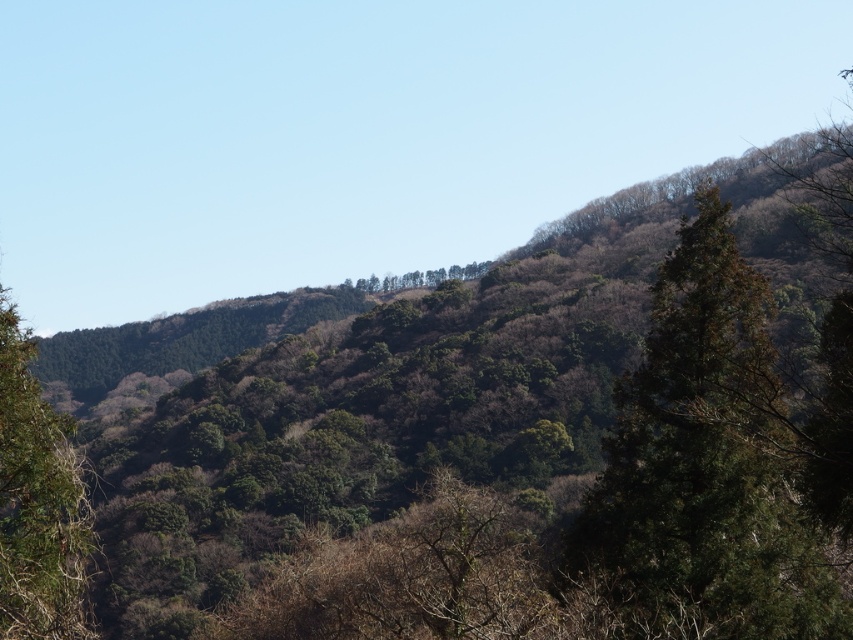
Looking at this image, is green leafy tree at left taller than green leafy trees at center?

In fact, green leafy tree at left may be shorter than green leafy trees at center.

Can you confirm if green leafy tree at left is positioned above green leafy trees at center?

Actually, green leafy tree at left is below green leafy trees at center.

Find the location of `green leafy tree at left`. green leafy tree at left is located at coordinates (38, 502).

Where is `dark green textured tree at upper right`? The width and height of the screenshot is (853, 640). dark green textured tree at upper right is located at coordinates (720, 460).

Is dark green textured tree at upper right further to camera compared to green leafy trees at center?

No, dark green textured tree at upper right is closer to the viewer.

The width and height of the screenshot is (853, 640). In order to click on dark green textured tree at upper right in this screenshot , I will do `click(720, 460)`.

Find the location of a particular element. dark green textured tree at upper right is located at coordinates (720, 460).

Can you confirm if dark green textured tree at upper right is thinner than green leafy tree at left?

No.

I want to click on dark green textured tree at upper right, so click(720, 460).

Image resolution: width=853 pixels, height=640 pixels. What do you see at coordinates (720, 460) in the screenshot?
I see `dark green textured tree at upper right` at bounding box center [720, 460].

This screenshot has width=853, height=640. I want to click on dark green textured tree at upper right, so click(720, 460).